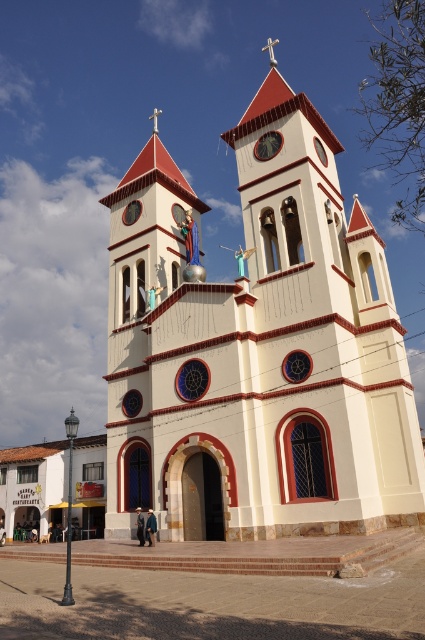
Does white stucco church tower at center have a larger size compared to metallic clock at upper center?

Yes, white stucco church tower at center is bigger than metallic clock at upper center.

Does point (257, 314) lie behind point (261, 148)?

No, it is not.

What are the coordinates of `white stucco church tower at center` in the screenshot? It's located at (257, 349).